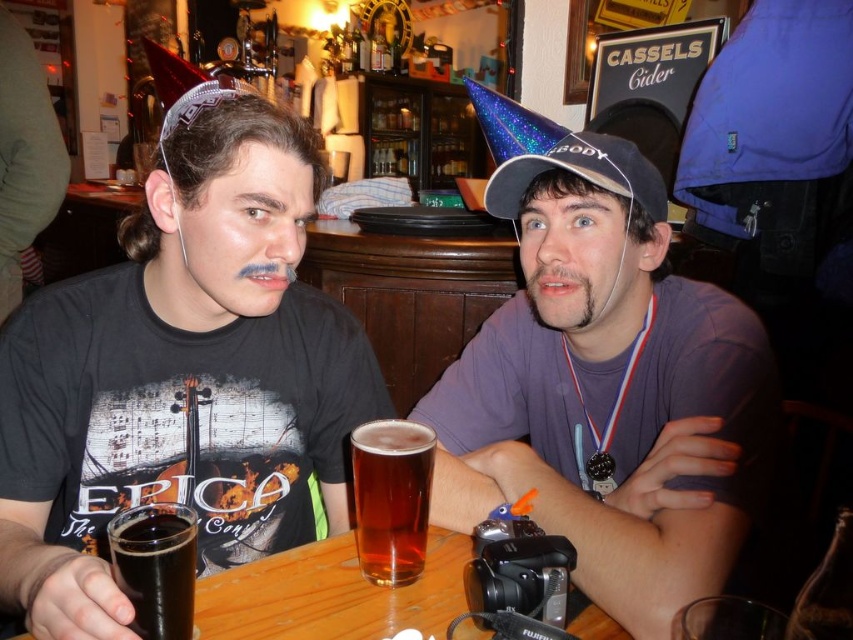
Question: Can you confirm if glittery blue baseball cap at center is thinner than dark glass beer at lower left?

Choices:
 (A) no
 (B) yes

Answer: (A)

Question: Can you confirm if glittery blue baseball cap at center is bigger than dark glass beer at lower left?

Choices:
 (A) no
 (B) yes

Answer: (B)

Question: Can you confirm if black matte t-shirt at left is positioned to the left of purple matte shirt at center?

Choices:
 (A) no
 (B) yes

Answer: (B)

Question: Estimate the real-world distances between objects in this image. Which object is closer to the dark glass beer at lower left?

Choices:
 (A) glittery blue baseball cap at center
 (B) black matte t-shirt at left

Answer: (B)

Question: Which point is closer to the camera?

Choices:
 (A) (492, 115)
 (B) (599, 198)
 (C) (169, 522)
 (D) (387, 500)

Answer: (C)

Question: Which object is farther from the camera taking this photo?

Choices:
 (A) amber glass beer at center
 (B) black matte t-shirt at left

Answer: (A)